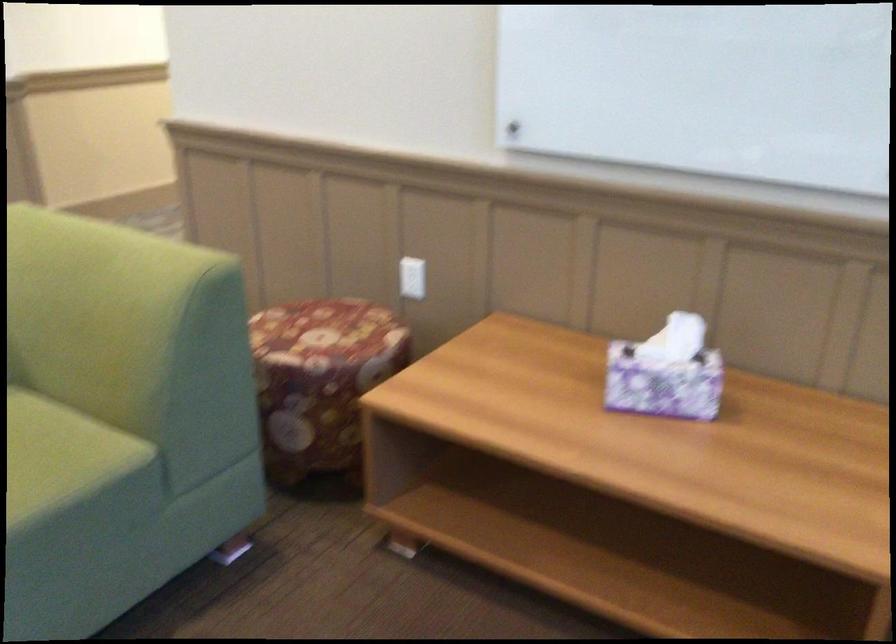
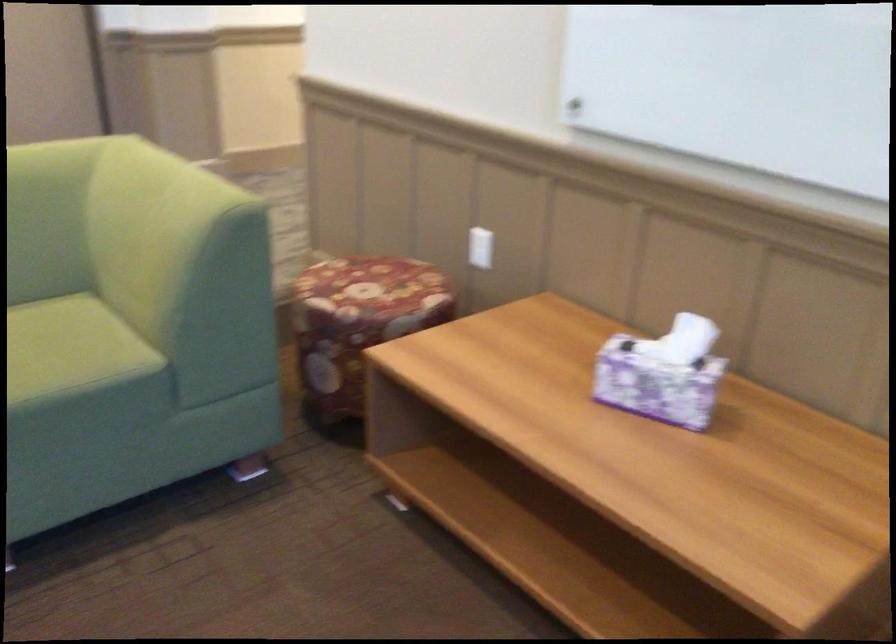
Find the pixel in the second image that matches (685,337) in the first image.

(690, 341)